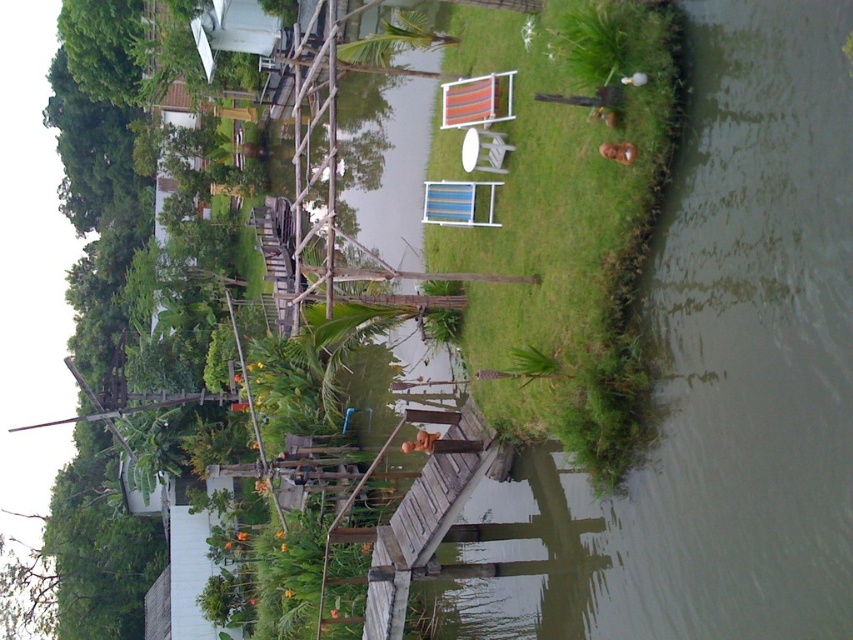
Question: Is green grassy water at right above green grass at center?

Choices:
 (A) yes
 (B) no

Answer: (B)

Question: Does green grassy water at right appear on the left side of green grass at center?

Choices:
 (A) no
 (B) yes

Answer: (A)

Question: Which object is farther from the camera taking this photo?

Choices:
 (A) green grassy water at right
 (B) green grass at center

Answer: (B)

Question: Is green grassy water at right closer to camera compared to green grass at center?

Choices:
 (A) yes
 (B) no

Answer: (A)

Question: Which object is closer to the camera taking this photo?

Choices:
 (A) green grass at center
 (B) green grassy water at right

Answer: (B)

Question: Which of the following is the closest to the observer?

Choices:
 (A) green grass at center
 (B) green grassy water at right

Answer: (B)